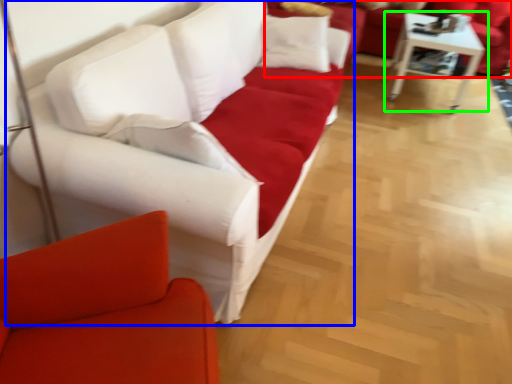
Question: Estimate the real-world distances between objects in this image. Which object is closer to studio couch (highlighted by a red box), studio couch (highlighted by a blue box) or table (highlighted by a green box)?

Choices:
 (A) studio couch
 (B) table

Answer: (B)